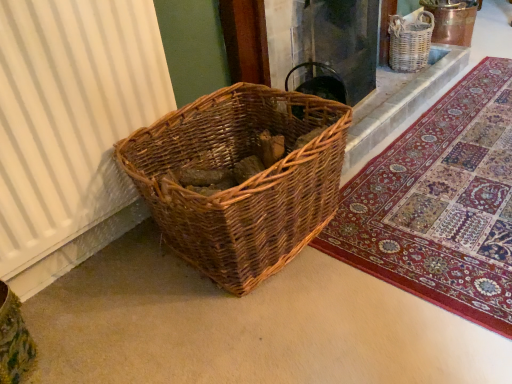
This screenshot has width=512, height=384. Identify the location of vacant space underneath white ribbed curtain at left (from a real-world perspective). (91, 243).